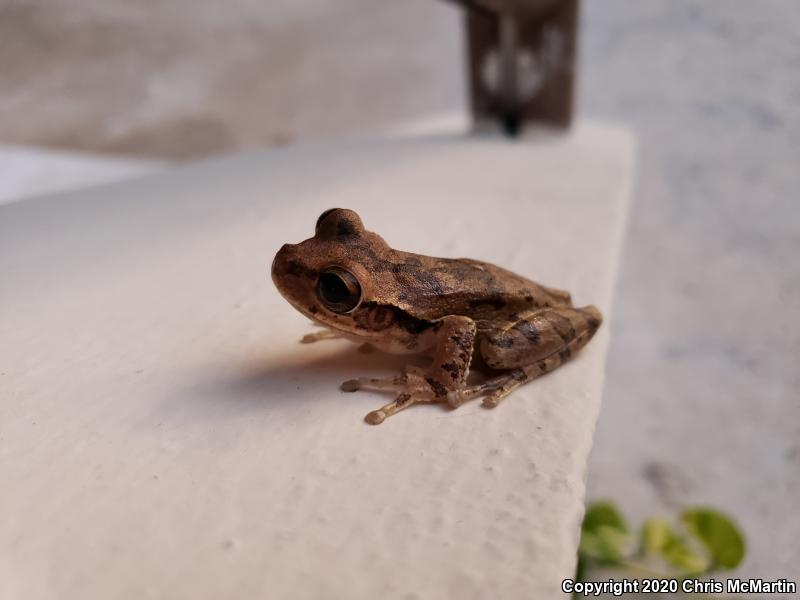
In order to click on white surface in this screenshot , I will do `click(204, 464)`.